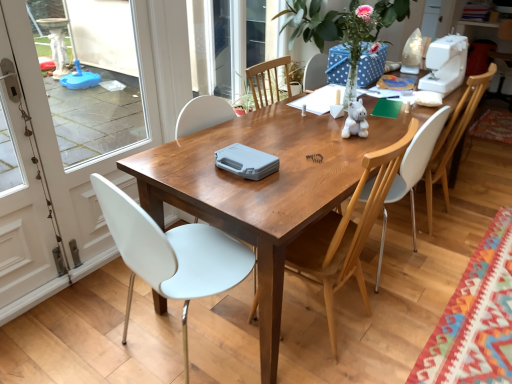
What do you see at coordinates (263, 188) in the screenshot? I see `wooden table at center` at bounding box center [263, 188].

What do you see at coordinates (475, 318) in the screenshot? I see `multicolored woven mat at lower right` at bounding box center [475, 318].

Identify the location of white plastic sewing machine at upper right. (445, 64).

What do you see at coordinates (445, 64) in the screenshot? Image resolution: width=512 pixels, height=384 pixels. I see `white plastic sewing machine at upper right` at bounding box center [445, 64].

What is the approximate width of white glossy screen door at left, which ranks as the second screen door in right-to-left order?

white glossy screen door at left, which ranks as the second screen door in right-to-left order, is 11.85 centimeters wide.

What do you see at coordinates (417, 162) in the screenshot? Image resolution: width=512 pixels, height=384 pixels. I see `white plastic chair at center, the third chair when ordered from left to right` at bounding box center [417, 162].

Locate an element on the screen. white glossy screen door at left, the second screen door in the left-to-right sequence is located at coordinates (71, 144).

Measure the distance between wooden chair at center, the second chair viewed from the left, and white plastic chair at right, which appears as the first chair when viewed from the right.

wooden chair at center, the second chair viewed from the left, and white plastic chair at right, which appears as the first chair when viewed from the right, are 35.54 inches apart.

Does point (325, 256) lie behind point (478, 92)?

No.

Which chair is the 2nd one when counting from the left side of the white plastic chair at right, which appears as the first chair when viewed from the right? Please provide its 2D coordinates.

[(347, 231)]

From the image's perspective, is wooden chair at center, the third chair viewed from the right, located beneath white plastic chair at right, the 4th chair in the left-to-right sequence?

Yes, from the image's perspective, wooden chair at center, the third chair viewed from the right, is below white plastic chair at right, the 4th chair in the left-to-right sequence.

Does point (364, 109) come farther from viewer compared to point (98, 94)?

No, it is in front of (98, 94).

From a real-world perspective, which object rests below the other?

In real-world perspective, white glossy screen door at left, which ranks as the first screen door in right-to-left order, is lower.

Considering the positions of objects white plush toy at center and white glossy screen door at left, the second screen door in the left-to-right sequence, in the image provided, who is more to the right, white plush toy at center or white glossy screen door at left, the second screen door in the left-to-right sequence,?

Positioned to the right is white plush toy at center.

From the image's perspective, is white plush toy at center located above or below white glossy screen door at left, the second screen door in the left-to-right sequence?

From the image's perspective, white plush toy at center appears above white glossy screen door at left, the second screen door in the left-to-right sequence.

Locate an element on the screen. This screenshot has height=384, width=512. the 1st screen door behind the white plastic chair at left, which appears as the 4th chair when viewed from the right, counting from the anchor's position is located at coordinates (25, 201).

Is point (11, 319) behind point (207, 251)?

Yes, it is.

Is white glossy screen door at left, which ranks as the second screen door in right-to-left order, taller or shorter than white plastic chair at left, which appears as the 4th chair when viewed from the right?

In the image, white glossy screen door at left, which ranks as the second screen door in right-to-left order, appears to be taller than white plastic chair at left, which appears as the 4th chair when viewed from the right.

Considering the sizes of objects white glossy screen door at left, which ranks as the second screen door in right-to-left order, and white plastic chair at left, which appears as the 4th chair when viewed from the right, in the image provided, who is thinner, white glossy screen door at left, which ranks as the second screen door in right-to-left order, or white plastic chair at left, which appears as the 4th chair when viewed from the right,?

white glossy screen door at left, which ranks as the second screen door in right-to-left order, is thinner.

In the scene shown: Can you tell me how much white plastic chair at center, the third chair when ordered from left to right, and white plastic chair at left, acting as the 1th chair starting from the left, differ in facing direction?

There is a 94.5-degree angle between the facing directions of white plastic chair at center, the third chair when ordered from left to right, and white plastic chair at left, acting as the 1th chair starting from the left.

Is white plastic chair at center, the third chair when ordered from left to right, looking in the opposite direction of white plastic chair at left, which appears as the 4th chair when viewed from the right?

No, white plastic chair at left, which appears as the 4th chair when viewed from the right, is not at the back of white plastic chair at center, the third chair when ordered from left to right.

Is white plastic chair at center, the third chair when ordered from left to right, beside white plastic chair at left, which appears as the 4th chair when viewed from the right?

white plastic chair at center, the third chair when ordered from left to right, and white plastic chair at left, which appears as the 4th chair when viewed from the right, are not in contact.

Is white plastic chair at center, marked as the second chair in a right-to-left arrangement, shorter than white plastic chair at left, acting as the 1th chair starting from the left?

In fact, white plastic chair at center, marked as the second chair in a right-to-left arrangement, may be taller than white plastic chair at left, acting as the 1th chair starting from the left.

Between wooden table at center and white plastic chair at right, the 4th chair in the left-to-right sequence, which one has more height?

white plastic chair at right, the 4th chair in the left-to-right sequence.

Is wooden table at center not near white plastic chair at right, the 4th chair in the left-to-right sequence?

No, wooden table at center is in close proximity to white plastic chair at right, the 4th chair in the left-to-right sequence.

The height and width of the screenshot is (384, 512). I want to click on kitchen & dining room table on the left of white plastic chair at right, which appears as the first chair when viewed from the right, so click(263, 188).

In the scene shown: From a real-world perspective, is wooden table at center positioned above or below white plastic chair at right, which appears as the first chair when viewed from the right?

wooden table at center is situated lower than white plastic chair at right, which appears as the first chair when viewed from the right, in the real world.

Does white plastic sewing machine at upper right come behind wooden table at center?

Yes, it is.

Identify the location of kitchen & dining room table in front of the white plastic sewing machine at upper right. The height and width of the screenshot is (384, 512). (263, 188).

Is white plastic sewing machine at upper right inside or outside of wooden table at center?

white plastic sewing machine at upper right is located beyond the bounds of wooden table at center.

In the scene shown: Are white plastic sewing machine at upper right and wooden table at center far apart?

That's not correct — white plastic sewing machine at upper right is a little close to wooden table at center.

Considering the relative sizes of white plastic sewing machine at upper right and white plastic chair at left, acting as the 1th chair starting from the left, in the image provided, is white plastic sewing machine at upper right bigger than white plastic chair at left, acting as the 1th chair starting from the left,?

No.

Where is `sewing machine lying on the right of white plastic chair at left, which appears as the 4th chair when viewed from the right`? sewing machine lying on the right of white plastic chair at left, which appears as the 4th chair when viewed from the right is located at coordinates (445, 64).

Considering the positions of points (466, 45) and (184, 359), is point (466, 45) farther from camera compared to point (184, 359)?

Yes, it is behind point (184, 359).

Considering the sizes of objects white plastic sewing machine at upper right and white plastic chair at left, which appears as the 4th chair when viewed from the right, in the image provided, who is shorter, white plastic sewing machine at upper right or white plastic chair at left, which appears as the 4th chair when viewed from the right,?

white plastic sewing machine at upper right is shorter.

There is a white plastic chair at right, the 4th chair in the left-to-right sequence. At what (x,y) coordinates should I click in order to perform the action: click on the 2nd chair below it (from the image's perspective). Please return your answer as a coordinate pair (x, y). Image resolution: width=512 pixels, height=384 pixels. Looking at the image, I should click on (347, 231).

Where is `toy that appears behind the white glossy screen door at left, the second screen door in the left-to-right sequence`? This screenshot has width=512, height=384. toy that appears behind the white glossy screen door at left, the second screen door in the left-to-right sequence is located at coordinates (356, 120).

When comparing their distances from white plush toy at center, does white plastic sewing machine at upper right or white plastic chair at right, which appears as the first chair when viewed from the right, seem closer?

Based on the image, white plastic chair at right, which appears as the first chair when viewed from the right, appears to be nearer to white plush toy at center.

In the scene shown: Looking at the image, which one is located further to white plastic chair at center, the third chair when ordered from left to right, wooden table at center or white plastic chair at right, the 4th chair in the left-to-right sequence?

wooden table at center is positioned further to the anchor white plastic chair at center, the third chair when ordered from left to right.

When comparing their distances from white glossy screen door at left, the second screen door in the left-to-right sequence, does white glossy screen door at left, which ranks as the second screen door in right-to-left order, or white plastic sewing machine at upper right seem closer?

white glossy screen door at left, which ranks as the second screen door in right-to-left order, is positioned closer to the anchor white glossy screen door at left, the second screen door in the left-to-right sequence.

Estimate the real-world distances between objects in this image. Which object is further from white glossy screen door at left, the second screen door in the left-to-right sequence, white plastic chair at center, the third chair when ordered from left to right, or white plush toy at center?

The object further to white glossy screen door at left, the second screen door in the left-to-right sequence, is white plush toy at center.

Consider the image. Which object lies nearer to the anchor point multicolored woven mat at lower right, white plush toy at center or white plastic chair at center, marked as the second chair in a right-to-left arrangement?

white plastic chair at center, marked as the second chair in a right-to-left arrangement, lies closer to multicolored woven mat at lower right than the other object.

Based on their spatial positions, is white plastic chair at center, the third chair when ordered from left to right, or white plastic chair at right, the 4th chair in the left-to-right sequence, closer to white glossy screen door at left, which ranks as the first screen door in right-to-left order?

white plastic chair at center, the third chair when ordered from left to right, lies closer to white glossy screen door at left, which ranks as the first screen door in right-to-left order, than the other object.

Considering their positions, is white plastic sewing machine at upper right positioned further to white glossy screen door at left, the second screen door in the left-to-right sequence, than multicolored woven mat at lower right?

multicolored woven mat at lower right lies further to white glossy screen door at left, the second screen door in the left-to-right sequence, than the other object.

From the image, which object appears to be farther from white glossy screen door at left, which ranks as the first screen door in right-to-left order, wooden table at center or wooden chair at center, the second chair viewed from the left?

wooden chair at center, the second chair viewed from the left, is further to white glossy screen door at left, which ranks as the first screen door in right-to-left order.

The width and height of the screenshot is (512, 384). Identify the location of kitchen & dining room table between white glossy screen door at left, which ranks as the first screen door in right-to-left order, and multicolored woven mat at lower right. (263, 188).

In order to click on mat positioned between wooden table at center and white plastic chair at right, which appears as the first chair when viewed from the right, from near to far in this screenshot , I will do `click(475, 318)`.

Image resolution: width=512 pixels, height=384 pixels. I want to click on toy located between white glossy screen door at left, which ranks as the 1th screen door in left-to-right order, and wooden table at center in the left-right direction, so click(x=356, y=120).

Locate an element on the screen. The height and width of the screenshot is (384, 512). chair between white plastic chair at left, which appears as the 4th chair when viewed from the right, and wooden table at center from left to right is located at coordinates (347, 231).